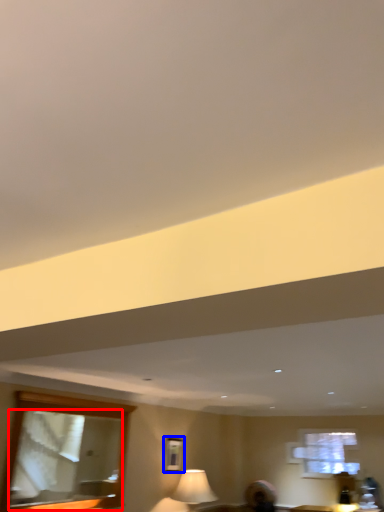
Question: Which of the following is the farthest to the observer, mirror (highlighted by a red box) or picture frame (highlighted by a blue box)?

Choices:
 (A) mirror
 (B) picture frame

Answer: (B)